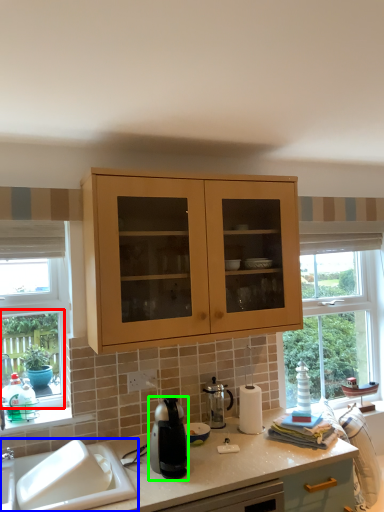
Question: Based on their relative distances, which object is farther from window frame (highlighted by a red box)? Choose from sink (highlighted by a blue box) and kitchen appliance (highlighted by a green box).

Choices:
 (A) sink
 (B) kitchen appliance

Answer: (B)